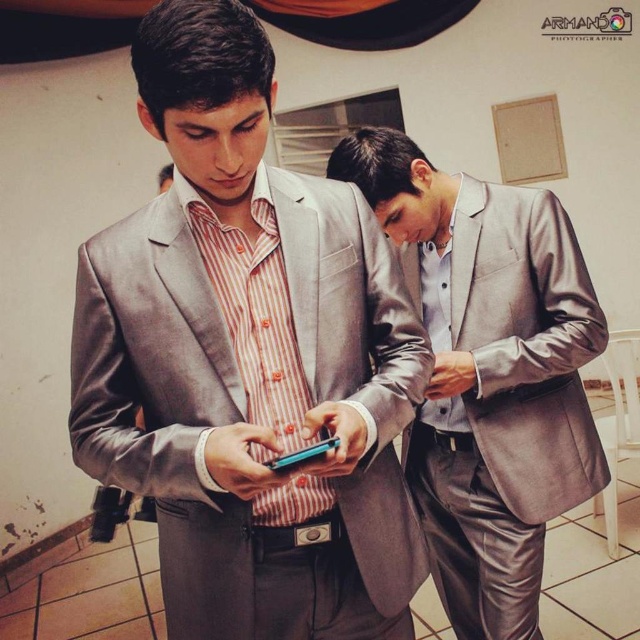
Is matte gray suit at center below teal glossy smartphone at center?

Incorrect, matte gray suit at center is not positioned below teal glossy smartphone at center.

Find the location of a particular element. The height and width of the screenshot is (640, 640). matte gray suit at center is located at coordinates (248, 358).

The height and width of the screenshot is (640, 640). I want to click on matte gray suit at center, so click(248, 358).

Does point (486, 506) come in front of point (275, 467)?

That is False.

Is satin gray suit at center below teal glossy smartphone at center?

Yes.

Between point (417, 284) and point (308, 448), which one is positioned in front?

Point (308, 448) is in front.

The width and height of the screenshot is (640, 640). Identify the location of satin gray suit at center. (488, 374).

Is matte gray suit at center to the left of satin gray suit at center from the viewer's perspective?

Yes, matte gray suit at center is to the left of satin gray suit at center.

Who is more forward, (x=296, y=566) or (x=540, y=420)?

Point (x=296, y=566) is more forward.

You are a GUI agent. You are given a task and a screenshot of the screen. Output one action in this format:
    pyautogui.click(x=<x>, y=<y>)
    Task: Click on the matte gray suit at center
    This screenshot has height=640, width=640.
    Given the screenshot: What is the action you would take?
    pyautogui.click(x=248, y=358)